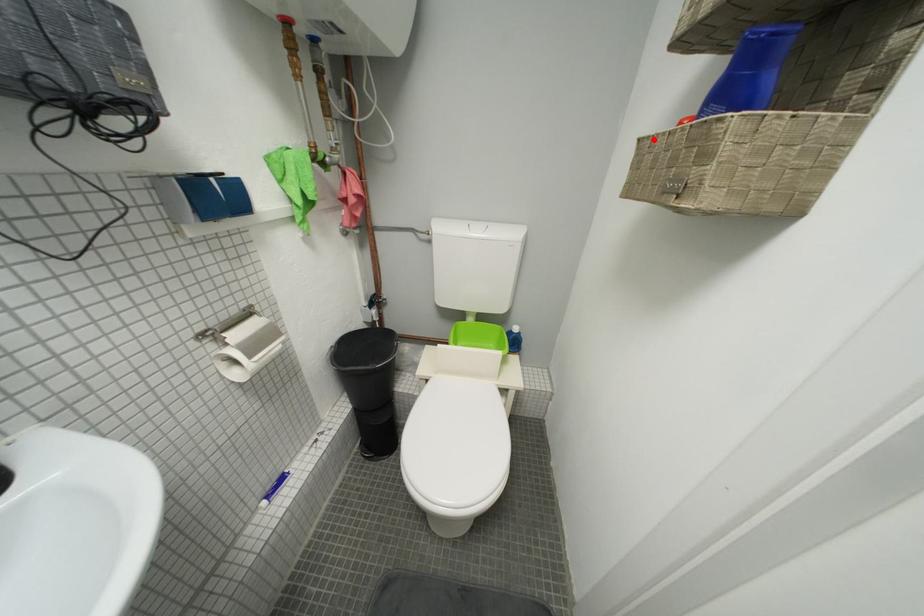
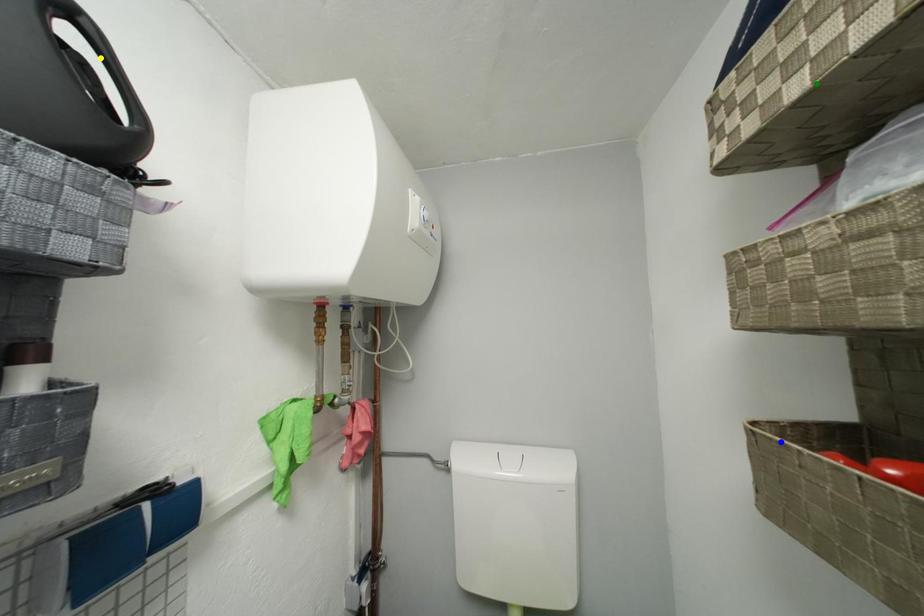
Question: I am providing you with two images of the same scene from different viewpoints. A red point is marked on the first image. You are given multiple points on the second image. Which spot in image 2 lines up with the point in image 1?

Choices:
 (A) blue point
 (B) green point
 (C) yellow point

Answer: (A)